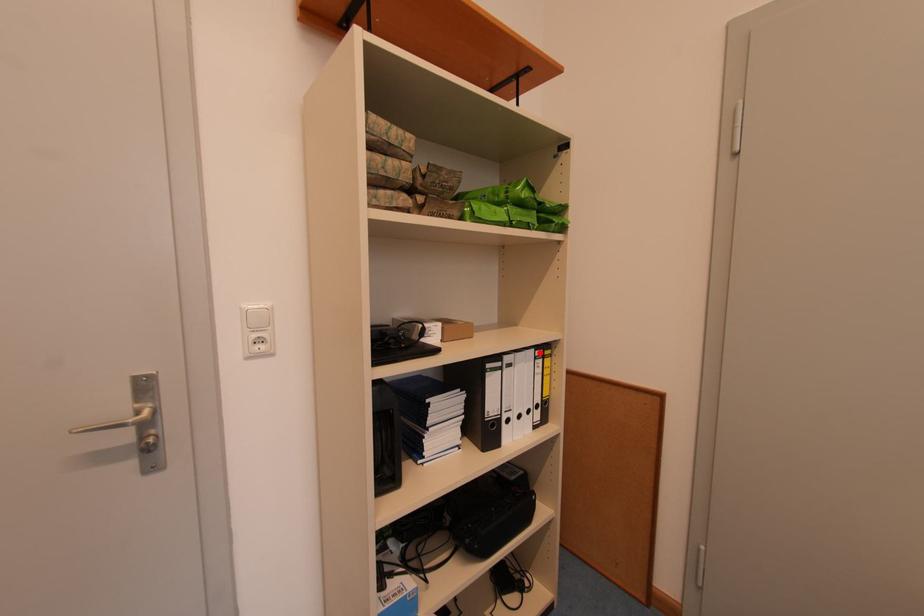
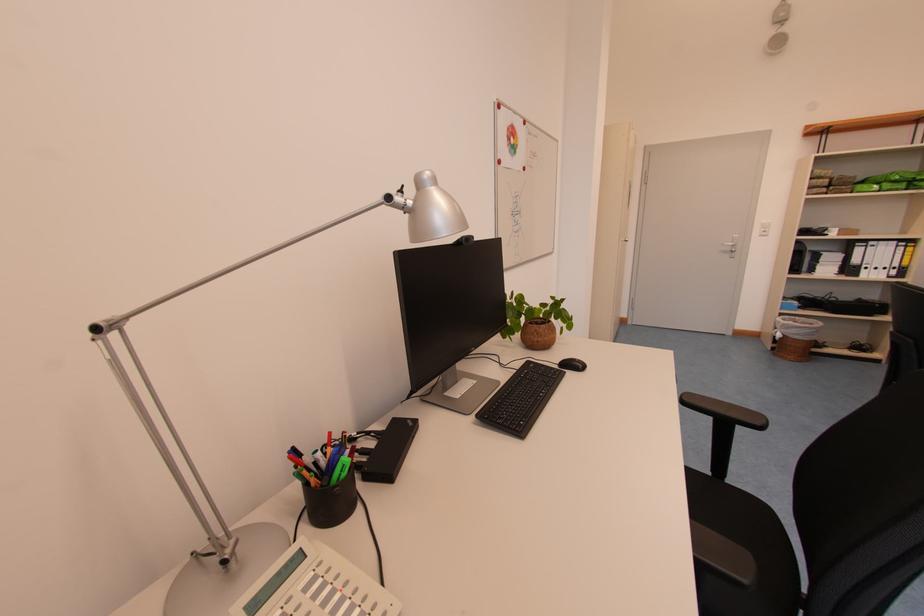
Locate, in the second image, the point that corresponds to the highlighted location in the first image.

(903, 245)